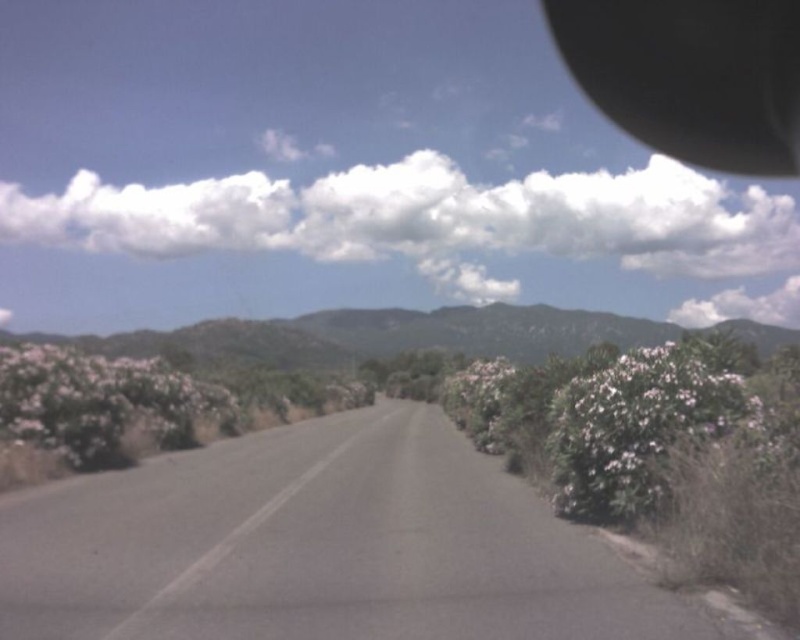
You are standing at the point marked as point (322, 547). Looking ahead, which direction does the gray asphalt road at center lead towards?

The gray asphalt road at center leads towards the right direction as it curves slightly to the right in the distance.

You are a pilot flying a small plane and want to navigate between the gray asphalt road at center and the white fluffy cloud at upper center. Which object should you fly under to avoid collisions?

You should fly under the white fluffy cloud at upper center because the gray asphalt road at center is located below it, so flying under the cloud would keep you above the road level.

You are a photographer planning to capture the entire scene of the gray asphalt road at center and the black rubber view mirror at upper right in one shot. Which object will appear smaller in the final photo?

The gray asphalt road at center will appear smaller in the photo because it occupies less space than the black rubber view mirror at upper right according to the description.